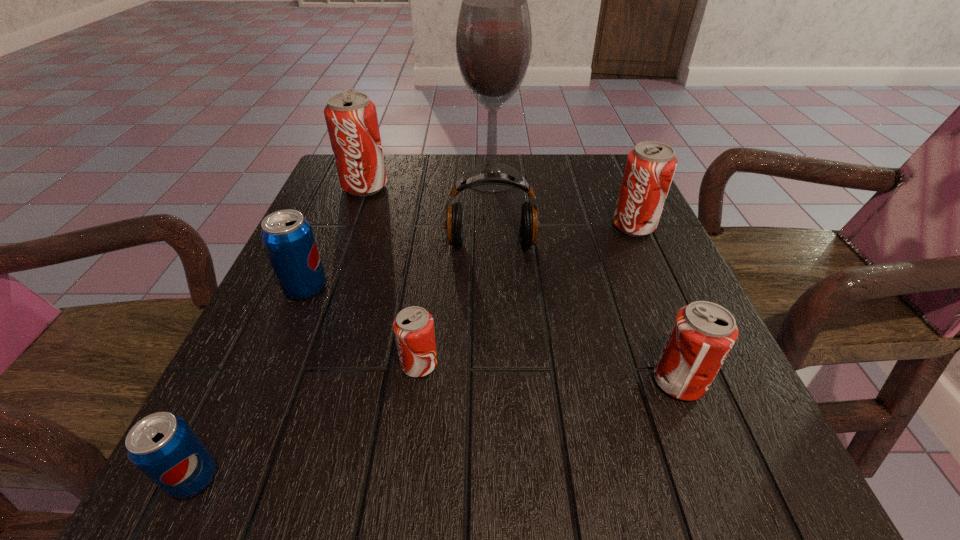
This screenshot has width=960, height=540. I want to click on free space at the right edge of the desktop, so click(657, 404).

You are a GUI agent. You are given a task and a screenshot of the screen. Output one action in this format:
    pyautogui.click(x=<x>, y=<y>)
    Task: Click on the vacant space at the far left corner of the desktop
    The image size is (960, 540).
    Given the screenshot: What is the action you would take?
    pyautogui.click(x=381, y=198)

I want to click on free spot at the far right corner of the desktop, so click(x=590, y=168).

In the image, there is a desktop. Identify the location of blank space at the near right corner. (700, 448).

The height and width of the screenshot is (540, 960). What are the coordinates of `vacant region between the second smallest pink soda can and the seventh shortest object` in the screenshot? It's located at (521, 284).

This screenshot has height=540, width=960. Find the location of `vacant point located between the biggest pink soda can and the alcohol`. vacant point located between the biggest pink soda can and the alcohol is located at coordinates (428, 181).

This screenshot has width=960, height=540. In order to click on free spot between the seventh shortest object and the fourth pop soda from left to right in this screenshot , I will do click(x=392, y=275).

The height and width of the screenshot is (540, 960). I want to click on free point between the bigger blue pop soda and the second farthest pop soda, so click(470, 256).

Identify the location of free space between the biggest pink soda can and the fourth pop soda from left to right. (392, 275).

I want to click on unoccupied area between the third nearest pink soda can and the red alcohol, so click(x=563, y=201).